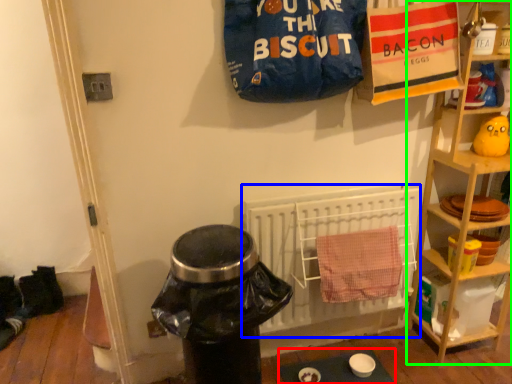
Question: Which is nearer to the table (highlighted by a red box)? radiator (highlighted by a blue box) or shelf (highlighted by a green box).

Choices:
 (A) radiator
 (B) shelf

Answer: (A)